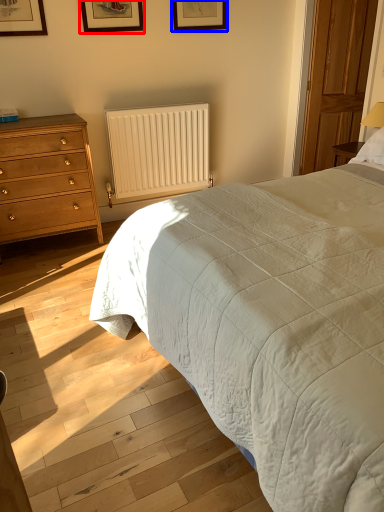
Question: Which object appears farthest to the camera in this image, picture frame (highlighted by a red box) or picture frame (highlighted by a blue box)?

Choices:
 (A) picture frame
 (B) picture frame

Answer: (B)